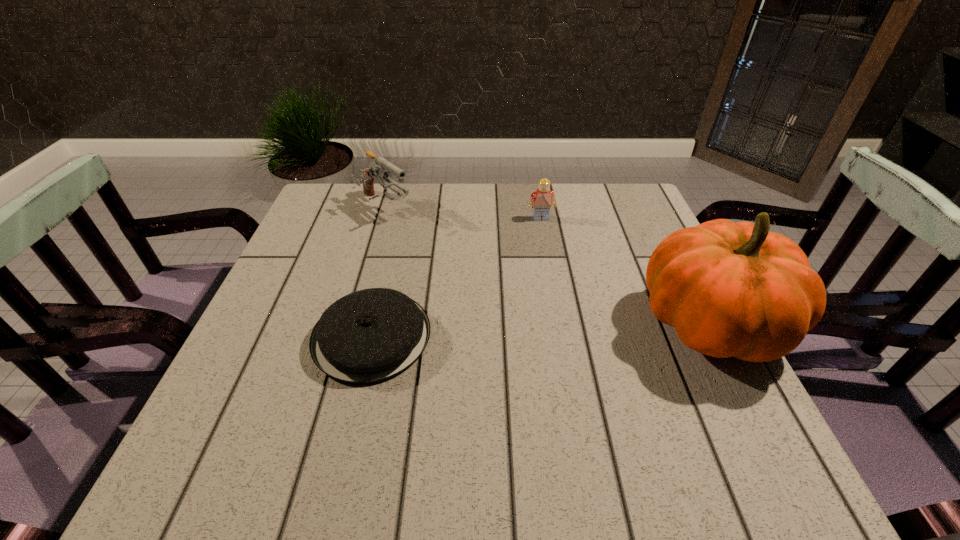
The width and height of the screenshot is (960, 540). Identify the location of the shortest object. (368, 336).

I want to click on the tallest object, so click(729, 289).

Where is `the rightmost object`? This screenshot has width=960, height=540. the rightmost object is located at coordinates point(729,289).

Where is `Lego`? Lego is located at coordinates (543, 198).

The width and height of the screenshot is (960, 540). Find the location of `the second object from right to left`. the second object from right to left is located at coordinates (543, 198).

At what (x,y) coordinates should I click in order to perform the action: click on the second tallest object. Please return your answer as a coordinate pair (x, y). Looking at the image, I should click on click(x=377, y=169).

The image size is (960, 540). Find the location of `vacant position located 0.240m on the back of the pancake`. vacant position located 0.240m on the back of the pancake is located at coordinates (396, 230).

Find the location of a particular element. The height and width of the screenshot is (540, 960). vacant space located on the back of the pumpkin is located at coordinates (669, 247).

The width and height of the screenshot is (960, 540). Find the location of `free space located 0.400m on the front-facing side of the second object from right to left`. free space located 0.400m on the front-facing side of the second object from right to left is located at coordinates (579, 336).

Locate an element on the screen. This screenshot has height=540, width=960. vacant space situated on the front-facing side of the second object from right to left is located at coordinates (569, 304).